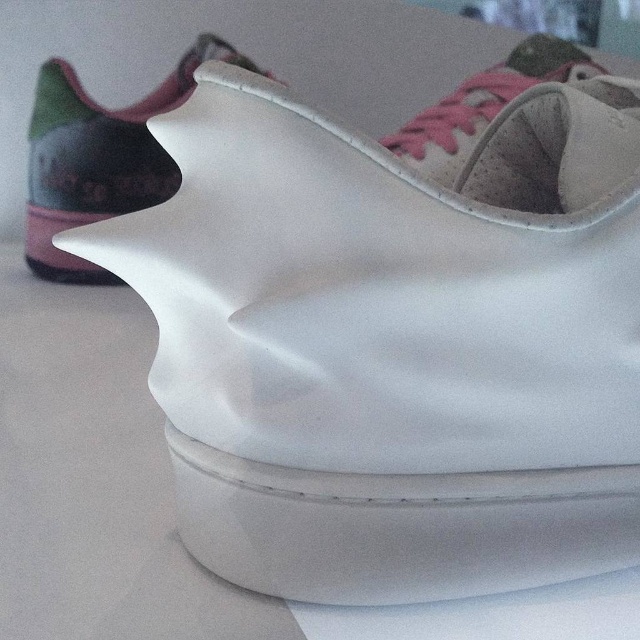
You are trying to decide which shoe to wear today. You have two options in front of you, the white matte shoe at upper center and the suede pink shoe at upper center. Based on their height, which one would you choose if you want a taller shoe?

The white matte shoe at upper center is taller than the suede pink shoe at upper center, so you should choose the white matte shoe at upper center if you want a taller shoe.

You are a designer trying to place a new sneaker design in the image. The new sneaker must be positioned exactly at the coordinates given for the white matte shoe at upper center. What are the coordinates where you should place the new sneaker?

The coordinates for the white matte shoe at upper center are at point (99, 157), so you should place the new sneaker at those exact coordinates.

You are trying to decide which shoe to wear today. You have two options in front of you, the white matte shoe at upper center and the suede pink shoe at upper center. Based on their sizes, which one would you choose if you prefer a smaller size?

The white matte shoe at upper center is smaller than the suede pink shoe at upper center, so you should choose the white matte shoe at upper center if you prefer a smaller size.